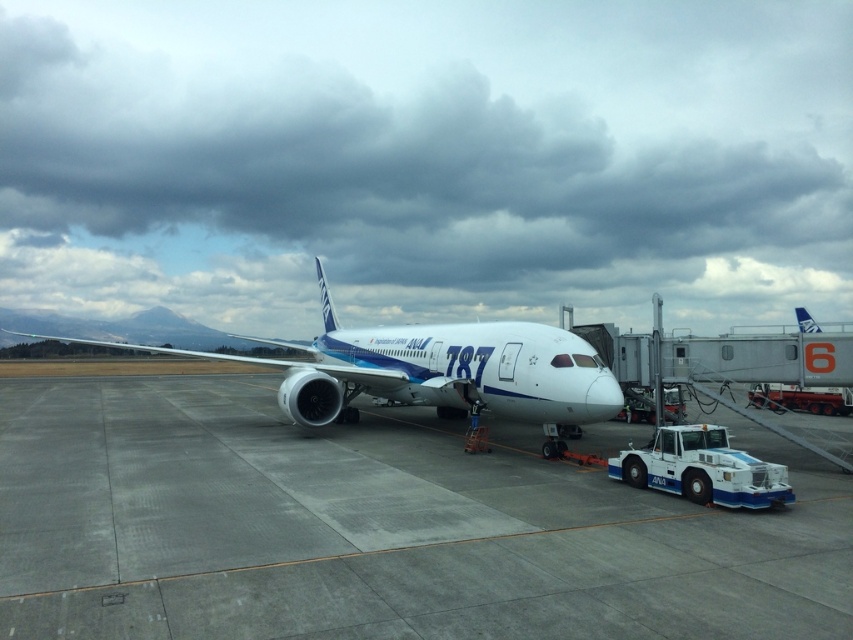
Question: Can you confirm if cloudy sky at upper center is positioned to the left of gray concrete tarmac at center?

Choices:
 (A) no
 (B) yes

Answer: (A)

Question: Is gray concrete tarmac at center above white glossy airplane at center?

Choices:
 (A) no
 (B) yes

Answer: (A)

Question: Which object appears farthest from the camera in this image?

Choices:
 (A) gray concrete tarmac at center
 (B) white glossy airplane at center

Answer: (B)

Question: Does cloudy sky at upper center appear on the right side of white glossy airplane at center?

Choices:
 (A) yes
 (B) no

Answer: (A)

Question: Which object is the closest to the white glossy airplane at center?

Choices:
 (A) cloudy sky at upper center
 (B) gray concrete tarmac at center

Answer: (B)

Question: Among these objects, which one is nearest to the camera?

Choices:
 (A) gray concrete tarmac at center
 (B) cloudy sky at upper center
 (C) white glossy airplane at center

Answer: (A)